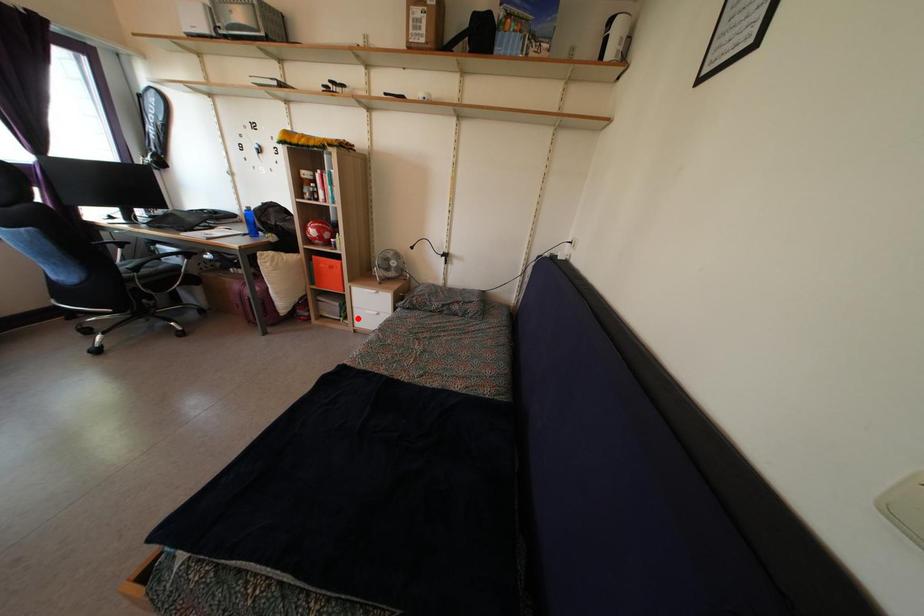
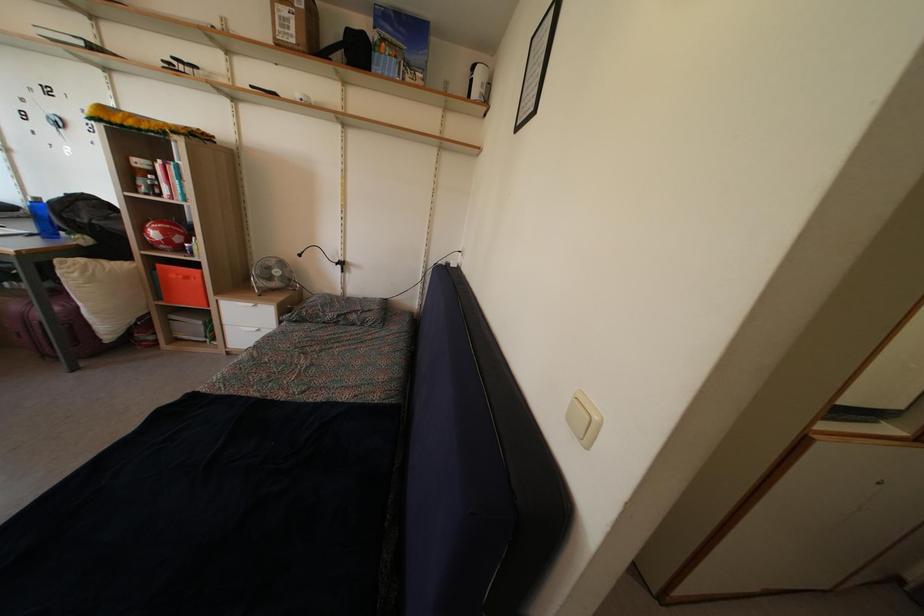
In the second image, find the point that corresponds to the highlighted location in the first image.

(228, 336)